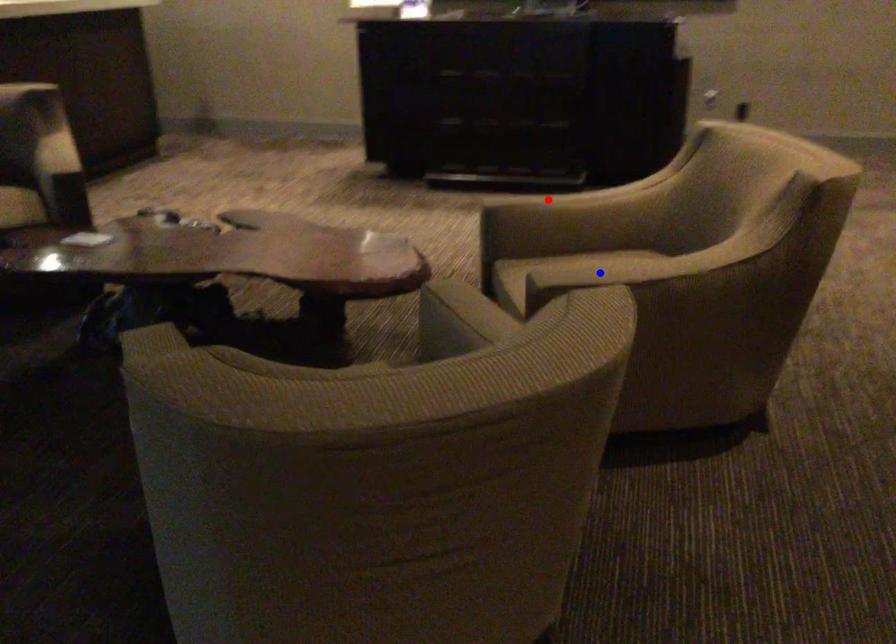
Question: In the image, two points are highlighted. Which point is nearer to the camera? Reply with the corresponding letter.

Choices:
 (A) blue point
 (B) red point

Answer: (A)